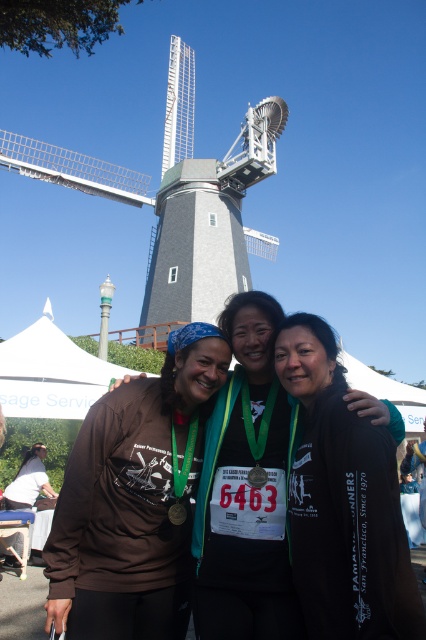
Is point (181, 120) behind point (226, 314)?

Yes, point (181, 120) is behind point (226, 314).

What do you see at coordinates (178, 196) in the screenshot? I see `gray wood windmill at upper center` at bounding box center [178, 196].

Find the location of a particular element. Image resolution: width=426 pixels, height=640 pixels. gray wood windmill at upper center is located at coordinates (178, 196).

Who is positioned more to the left, matte brown shirt at center or matte black shirt at center?

From the viewer's perspective, matte brown shirt at center appears more on the left side.

Who is positioned more to the right, matte brown shirt at center or matte black shirt at center?

Positioned to the right is matte black shirt at center.

The width and height of the screenshot is (426, 640). What do you see at coordinates (135, 500) in the screenshot?
I see `matte brown shirt at center` at bounding box center [135, 500].

Locate an element on the screen. Image resolution: width=426 pixels, height=640 pixels. matte brown shirt at center is located at coordinates (135, 500).

Does black matte jacket at center have a larger size compared to gray wood windmill at upper center?

No.

Is black matte jacket at center in front of gray wood windmill at upper center?

Yes, black matte jacket at center is closer to the viewer.

This screenshot has width=426, height=640. What do you see at coordinates (342, 502) in the screenshot? I see `black matte jacket at center` at bounding box center [342, 502].

In order to click on black matte jacket at center in this screenshot , I will do `click(342, 502)`.